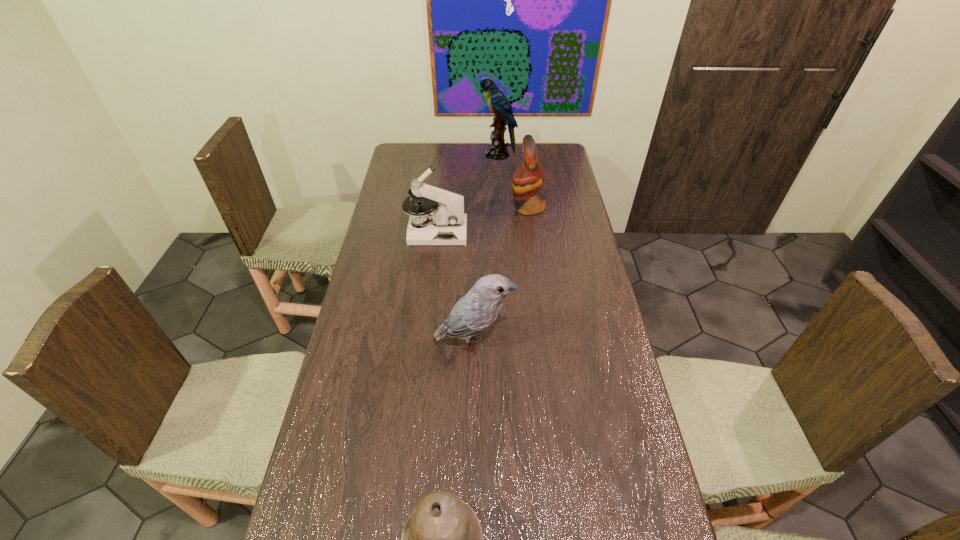
Locate an element on the screen. The image size is (960, 540). the farthest parrot is located at coordinates (498, 103).

Locate an element on the screen. This screenshot has width=960, height=540. the second farthest parrot is located at coordinates (529, 177).

Find the location of a particular element. This screenshot has width=960, height=540. microscope is located at coordinates point(444,224).

This screenshot has width=960, height=540. I want to click on the nearest parrot, so click(477, 310).

Where is `vacant space situated 0.060m on the face of the farthest parrot`? vacant space situated 0.060m on the face of the farthest parrot is located at coordinates (468, 154).

At what (x,y) coordinates should I click in order to perform the action: click on free location located 0.150m on the face of the farthest parrot. Please return your answer as a coordinate pair (x, y). Looking at the image, I should click on (x=448, y=154).

The height and width of the screenshot is (540, 960). In order to click on free spot located 0.340m on the face of the farthest parrot in this screenshot , I will do `click(409, 154)`.

I want to click on vacant region located 0.240m on the face of the second farthest parrot, so [453, 207].

This screenshot has height=540, width=960. I want to click on vacant region located 0.250m on the face of the second farthest parrot, so click(450, 207).

Locate an element on the screen. vacant space located on the face of the second farthest parrot is located at coordinates (479, 207).